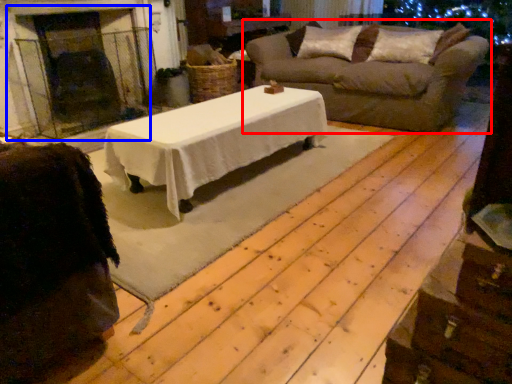
Question: Which object is further to the camera taking this photo, studio sofa (highlighted by a red box) or fireplace (highlighted by a blue box)?

Choices:
 (A) studio sofa
 (B) fireplace

Answer: (B)